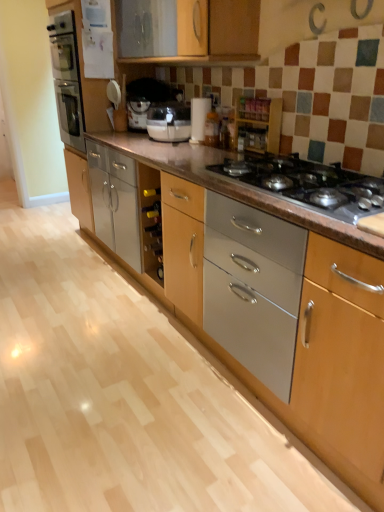
Question: Could you tell me if wooden spice rack at upper center is turned towards metallic gray gas stove at center?

Choices:
 (A) no
 (B) yes

Answer: (A)

Question: Would you consider wooden spice rack at upper center to be distant from metallic gray gas stove at center?

Choices:
 (A) no
 (B) yes

Answer: (A)

Question: From a real-world perspective, is wooden spice rack at upper center positioned over metallic gray gas stove at center based on gravity?

Choices:
 (A) no
 (B) yes

Answer: (B)

Question: Does wooden spice rack at upper center have a greater height compared to metallic gray gas stove at center?

Choices:
 (A) no
 (B) yes

Answer: (B)

Question: Is the position of wooden spice rack at upper center more distant than that of metallic gray gas stove at center?

Choices:
 (A) no
 (B) yes

Answer: (B)

Question: From the image's perspective, is wooden spice rack at upper center located above metallic gray gas stove at center?

Choices:
 (A) yes
 (B) no

Answer: (A)

Question: Is white paper towel holder at center smaller than wooden spice rack at upper center?

Choices:
 (A) yes
 (B) no

Answer: (A)

Question: Is the depth of white paper towel holder at center less than that of wooden spice rack at upper center?

Choices:
 (A) no
 (B) yes

Answer: (A)

Question: Is the position of white paper towel holder at center more distant than that of wooden spice rack at upper center?

Choices:
 (A) no
 (B) yes

Answer: (B)

Question: From a real-world perspective, is white paper towel holder at center located beneath wooden spice rack at upper center?

Choices:
 (A) no
 (B) yes

Answer: (A)

Question: Is white paper towel holder at center taller than wooden spice rack at upper center?

Choices:
 (A) no
 (B) yes

Answer: (B)

Question: From the image's perspective, is white paper towel holder at center below wooden spice rack at upper center?

Choices:
 (A) yes
 (B) no

Answer: (B)

Question: Is the position of metallic gray gas stove at center more distant than that of wooden spice rack at upper center?

Choices:
 (A) yes
 (B) no

Answer: (B)